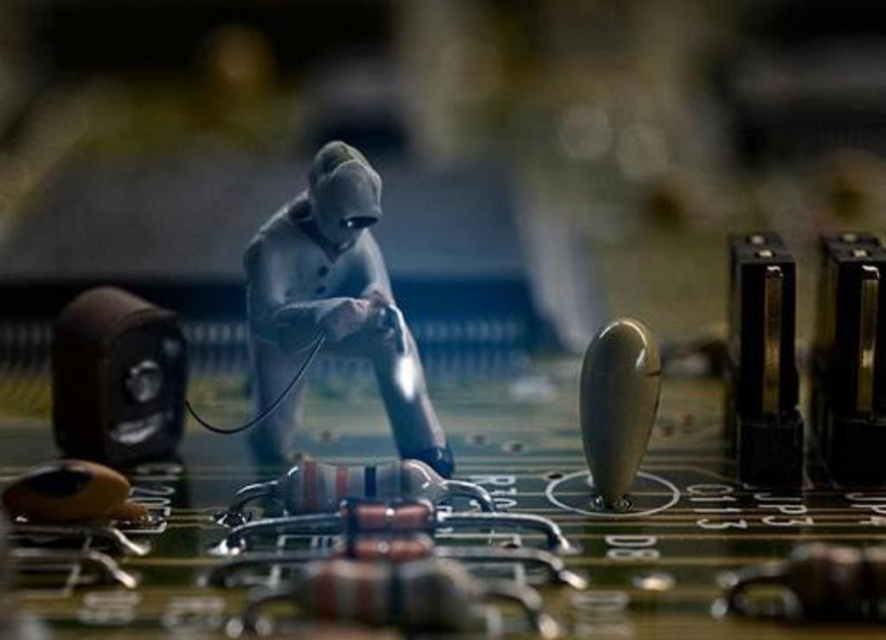
You are a photographer standing 1.5 meters away from the silver metallic figure at center in the image. You want to take a closeup shot of the figure without moving your position. Is the distance sufficient for a clear closeup?

The silver metallic figure at center is 1.04 meters away from the viewer. Since you are standing 1.5 meters away, the distance is sufficient for a clear closeup as it is within reach without needing to move closer.